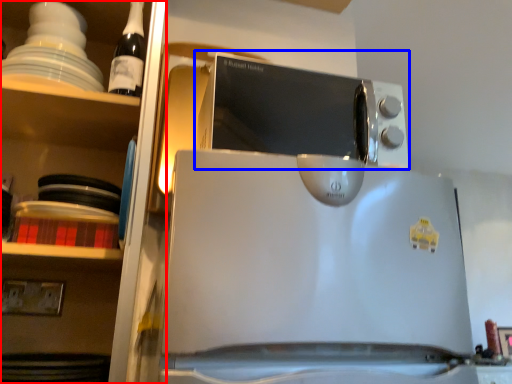
Question: Among these objects, which one is nearest to the camera, shelf (highlighted by a red box) or microwave oven (highlighted by a blue box)?

Choices:
 (A) shelf
 (B) microwave oven

Answer: (A)